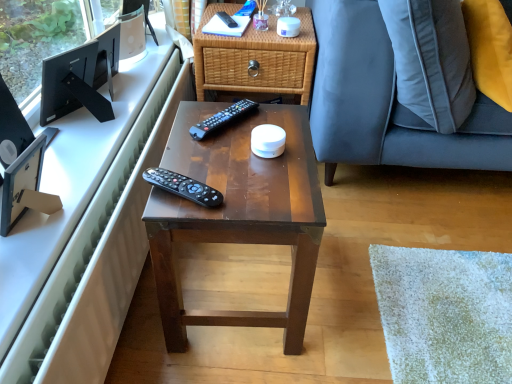
Find the location of `free space behind black plastic picture frame at left, marked as the second television in a back-to-front arrangement`. free space behind black plastic picture frame at left, marked as the second television in a back-to-front arrangement is located at coordinates pos(75,169).